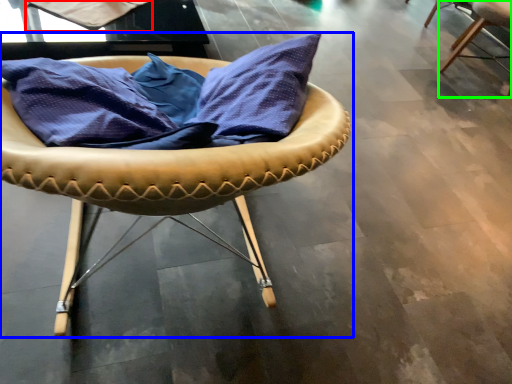
Question: Estimate the real-world distances between objects in this image. Which object is closer to fabric (highlighted by a red box), chair (highlighted by a blue box) or chair (highlighted by a green box)?

Choices:
 (A) chair
 (B) chair

Answer: (A)